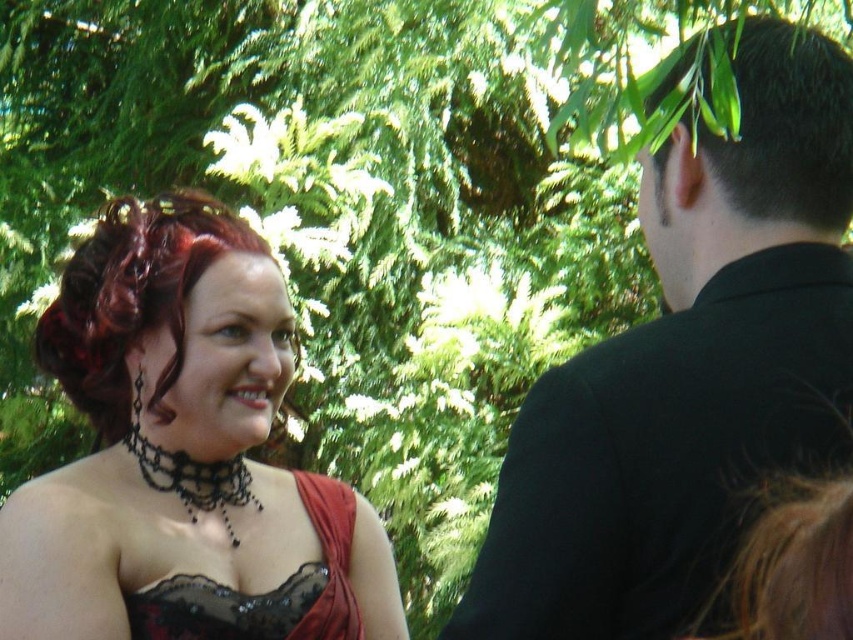
In order to click on lace fabric dress at left in this screenshot , I will do (x=183, y=454).

Locate an element on the screen. Image resolution: width=853 pixels, height=640 pixels. lace fabric dress at left is located at coordinates (183, 454).

Who is more forward, (x=80, y=412) or (x=316, y=577)?

Positioned in front is point (x=316, y=577).

Which of these two, dark red curly hair at left or black lace dress at center, stands taller?

dark red curly hair at left is taller.

Which is in front, point (120, 280) or point (262, 624)?

Point (262, 624)

This screenshot has height=640, width=853. I want to click on dark red curly hair at left, so click(132, 300).

Who is more forward, (663, 227) or (746, 51)?

Point (746, 51) is more forward.

Can you confirm if black matte suit at upper right is positioned below dark brown hair at upper right?

Yes, black matte suit at upper right is below dark brown hair at upper right.

Is point (706, 531) farther from camera compared to point (758, 56)?

No.

Where is `black matte suit at upper right`? The width and height of the screenshot is (853, 640). black matte suit at upper right is located at coordinates (689, 372).